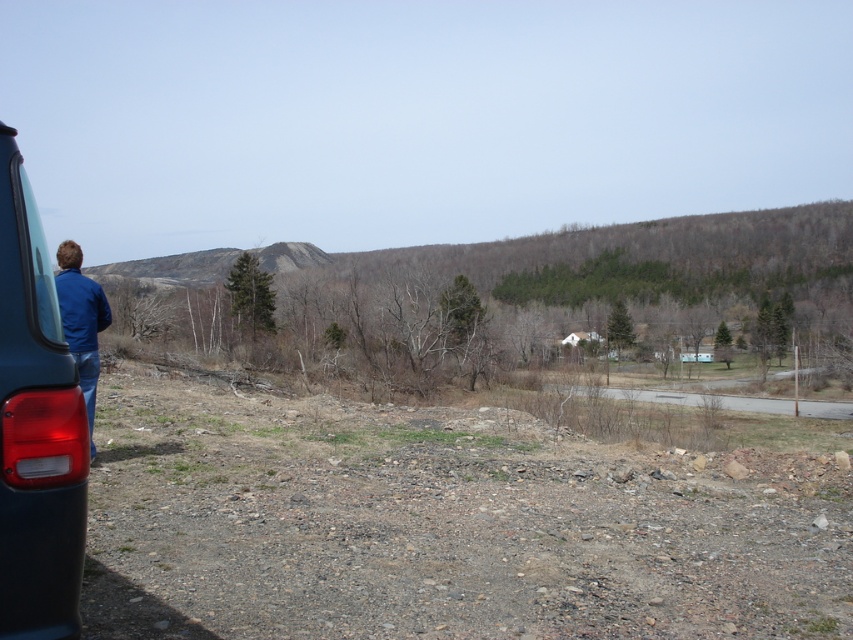
Is the position of matte black car at left more distant than that of blue denim jacket at left?

No, matte black car at left is closer to the viewer.

Consider the image. Which of these two, matte black car at left or blue denim jacket at left, stands shorter?

matte black car at left is shorter.

Identify the location of matte black car at left. (35, 428).